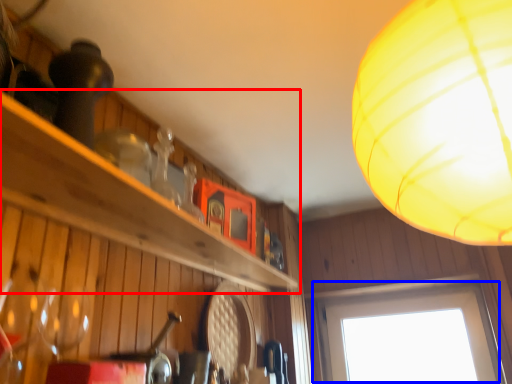
Question: Which point is closer to the camera, shelf (highlighted by a red box) or window (highlighted by a blue box)?

Choices:
 (A) shelf
 (B) window

Answer: (A)